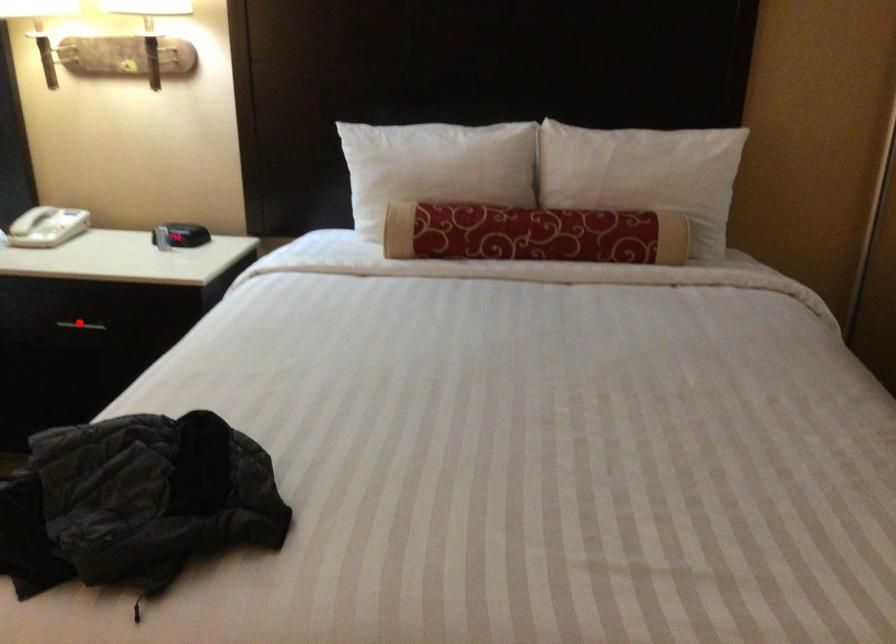
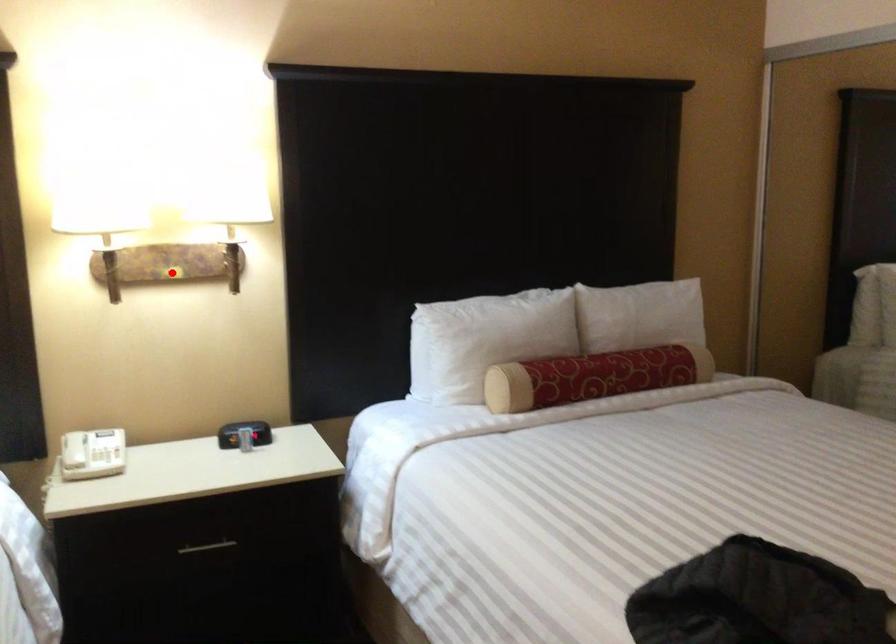
I am providing you with two images of the same scene from different viewpoints. A red point is marked on the first image and another point is marked on the second image. Are the points marked in image1 and image2 representing the same 3D position?

No